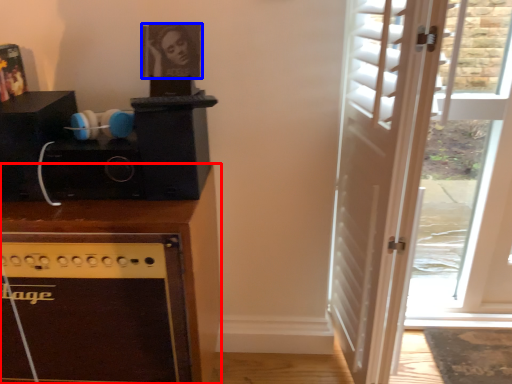
Question: Which of the following is the farthest to the observer, cabinetry (highlighted by a red box) or picture frame (highlighted by a blue box)?

Choices:
 (A) cabinetry
 (B) picture frame

Answer: (B)